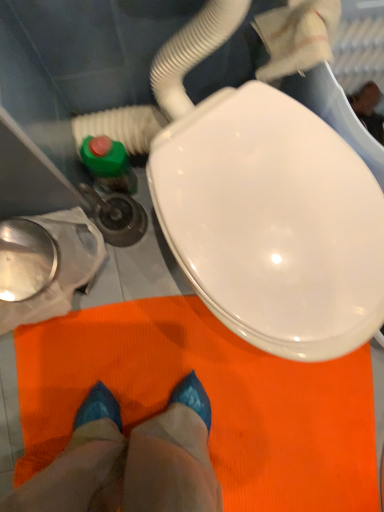
Question: From the image's perspective, is green plastic water pipe at left located above or below blue glossy shoes at center?

Choices:
 (A) above
 (B) below

Answer: (A)

Question: Considering the positions of point (127, 113) and point (158, 503), is point (127, 113) closer or farther from the camera than point (158, 503)?

Choices:
 (A) closer
 (B) farther

Answer: (B)

Question: Is green plastic water pipe at left taller or shorter than blue glossy shoes at center?

Choices:
 (A) tall
 (B) short

Answer: (A)

Question: From a real-world perspective, is blue glossy shoes at center above or below green plastic water pipe at left?

Choices:
 (A) above
 (B) below

Answer: (B)

Question: Is blue glossy shoes at center inside the boundaries of green plastic water pipe at left, or outside?

Choices:
 (A) inside
 (B) outside

Answer: (B)

Question: Considering the relative positions of blue glossy shoes at center and green plastic water pipe at left in the image provided, is blue glossy shoes at center to the left or to the right of green plastic water pipe at left?

Choices:
 (A) left
 (B) right

Answer: (B)

Question: Relative to green plastic water pipe at left, is blue glossy shoes at center in front or behind?

Choices:
 (A) front
 (B) behind

Answer: (B)